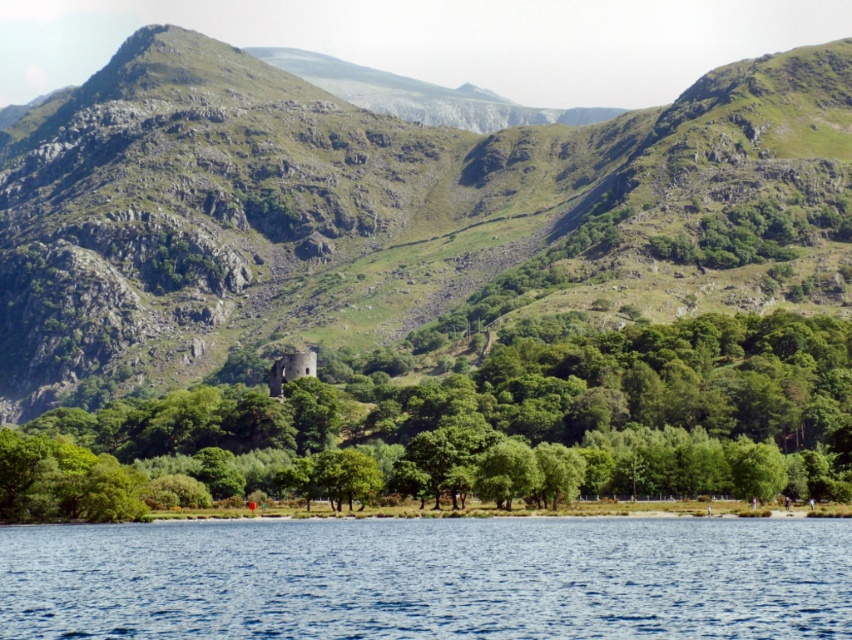
Does point (0, 140) lie behind point (444, 556)?

Yes, point (0, 140) is farther from viewer.

Find the location of a particular element. The width and height of the screenshot is (852, 640). green rocky mountain at center is located at coordinates (355, 205).

At what (x,y) coordinates should I click in order to perform the action: click on blue liquid water at lower center. Please return your answer as a coordinate pair (x, y). The width and height of the screenshot is (852, 640). Looking at the image, I should click on (429, 579).

This screenshot has height=640, width=852. Find the location of `blue liquid water at lower center`. blue liquid water at lower center is located at coordinates (429, 579).

You are a GUI agent. You are given a task and a screenshot of the screen. Output one action in this format:
    pyautogui.click(x=<x>, y=<y>)
    Task: Click on the blue liquid water at lower center
    This screenshot has width=852, height=640.
    Given the screenshot: What is the action you would take?
    pyautogui.click(x=429, y=579)

Is point (73, 230) farther from viewer compared to point (635, 422)?

Yes, it is behind point (635, 422).

Is point (815, 193) more distant than point (444, 488)?

That is True.

In order to click on green rocky mountain at center in this screenshot , I will do `click(355, 205)`.